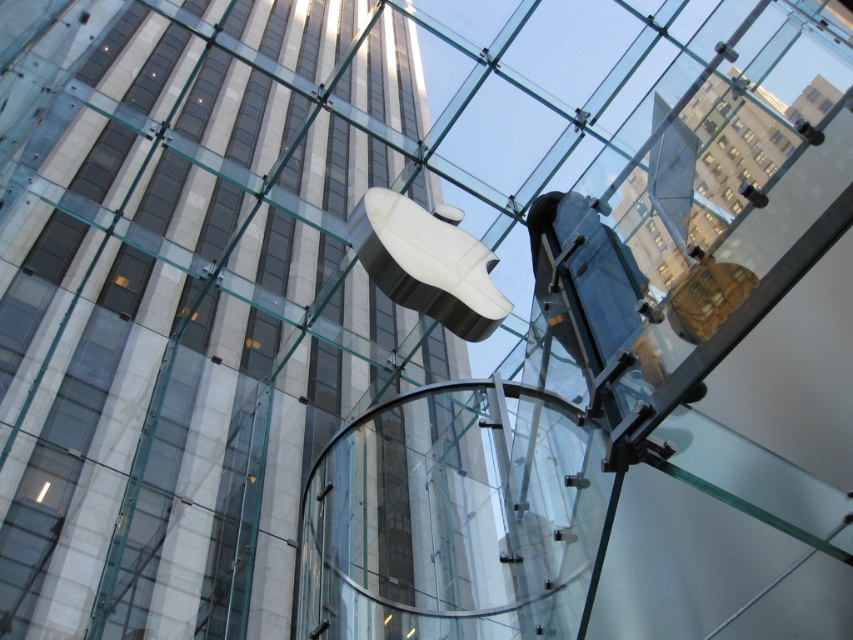
You are an interior designer planning to place a new rectangular table between the satin silver sculpture at center and the matte silver lamp at upper center. The table must fit snugly without touching either object. Given that the sculpture is wider than the lamp, which object should the table be aligned closer to to ensure proper spacing?

The table should be aligned closer to the matte silver lamp at upper center because the satin silver sculpture at center is wider, requiring more space between them to ensure proper spacing.